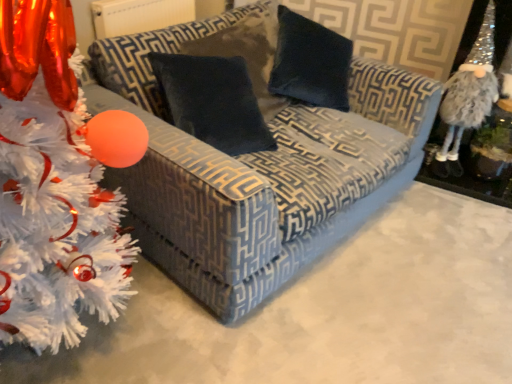
Question: From the image's perspective, would you say velvet-patterned couch at center is positioned over white fluffy christmas tree at left?

Choices:
 (A) no
 (B) yes

Answer: (B)

Question: Is white fluffy christmas tree at left inside velvet-patterned couch at center?

Choices:
 (A) no
 (B) yes

Answer: (A)

Question: Is velvet-patterned couch at center thinner than white fluffy christmas tree at left?

Choices:
 (A) yes
 (B) no

Answer: (B)

Question: From a real-world perspective, is velvet-patterned couch at center beneath white fluffy christmas tree at left?

Choices:
 (A) yes
 (B) no

Answer: (A)

Question: Considering the relative sizes of velvet-patterned couch at center and white fluffy christmas tree at left in the image provided, is velvet-patterned couch at center taller than white fluffy christmas tree at left?

Choices:
 (A) yes
 (B) no

Answer: (B)

Question: Is there a large distance between velvet-patterned couch at center and white fluffy christmas tree at left?

Choices:
 (A) no
 (B) yes

Answer: (A)

Question: From a real-world perspective, is fuzzy silver gnome at right beneath velvet-patterned couch at center?

Choices:
 (A) yes
 (B) no

Answer: (B)

Question: Are fuzzy silver gnome at right and velvet-patterned couch at center making contact?

Choices:
 (A) no
 (B) yes

Answer: (A)

Question: Can you confirm if fuzzy silver gnome at right is thinner than velvet-patterned couch at center?

Choices:
 (A) yes
 (B) no

Answer: (A)

Question: Is fuzzy silver gnome at right closer to camera compared to velvet-patterned couch at center?

Choices:
 (A) no
 (B) yes

Answer: (A)

Question: Is fuzzy silver gnome at right at the left side of velvet-patterned couch at center?

Choices:
 (A) no
 (B) yes

Answer: (A)

Question: Can you confirm if fuzzy silver gnome at right is bigger than velvet-patterned couch at center?

Choices:
 (A) yes
 (B) no

Answer: (B)

Question: Is velvet dark blue pillow at center far away from fuzzy silver gnome at right?

Choices:
 (A) yes
 (B) no

Answer: (A)